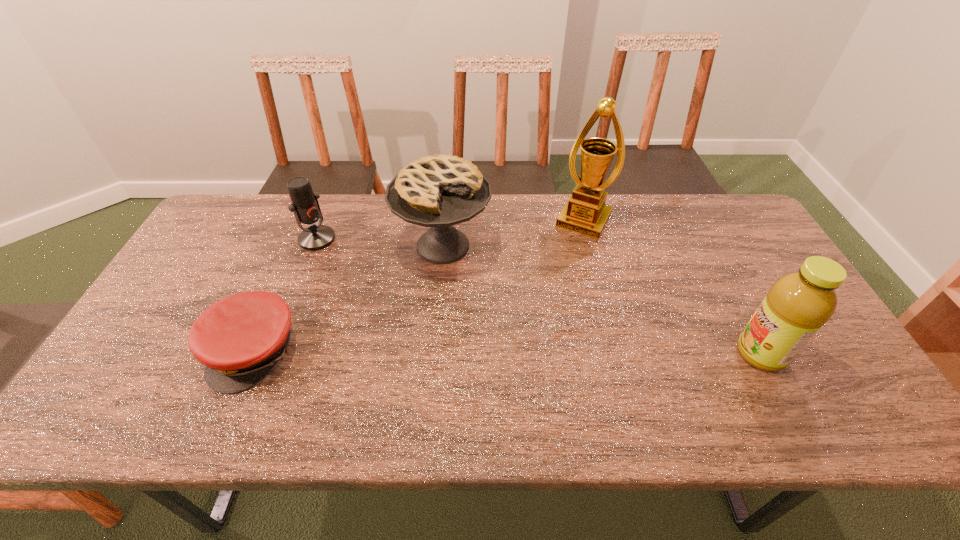
Locate an element on the screen. This screenshot has width=960, height=540. cap is located at coordinates (239, 339).

This screenshot has height=540, width=960. Identify the location of fruit juice. (798, 304).

At what (x,y) coordinates should I click in order to perform the action: click on the tallest object. Please return your answer as a coordinate pair (x, y). Looking at the image, I should click on (585, 212).

This screenshot has height=540, width=960. What are the coordinates of `award` in the screenshot? It's located at (585, 212).

What are the coordinates of `pie` in the screenshot? It's located at (439, 191).

Locate an element on the screen. microphone is located at coordinates (305, 206).

Identify the location of free spot located 0.150m on the front label of the fruit juice. (675, 354).

I want to click on free location located on the front label of the fruit juice, so click(662, 354).

The image size is (960, 540). I want to click on vacant area located 0.400m on the front label of the fruit juice, so click(x=573, y=354).

At what (x,y) coordinates should I click in order to perform the action: click on free spot located on the front-facing side of the fourth object from left to right. Please return your answer as a coordinate pair (x, y). Image resolution: width=960 pixels, height=540 pixels. Looking at the image, I should click on (544, 292).